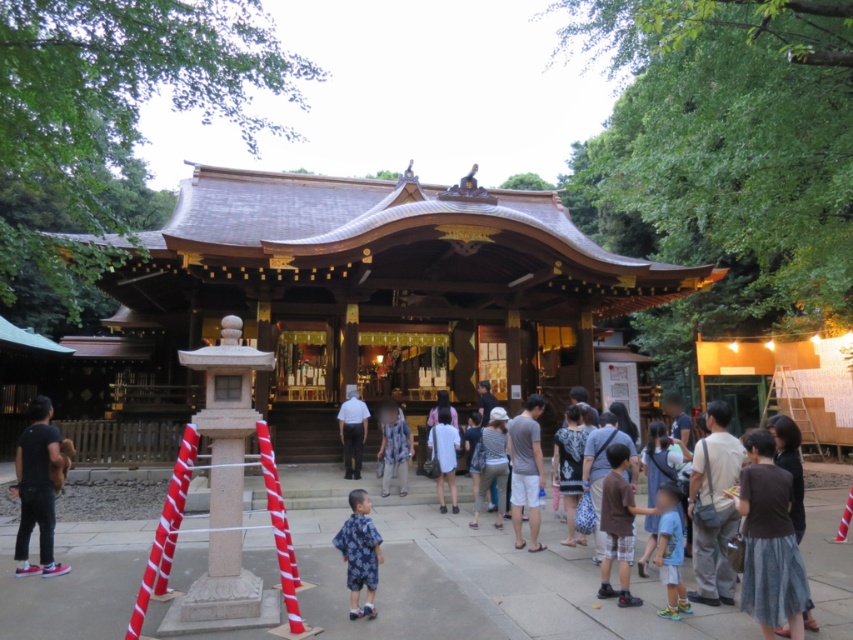
Question: Where is dark gray fabric pants at lower left located in relation to white cotton shirt at center in the image?

Choices:
 (A) right
 (B) left

Answer: (B)

Question: Which point is closer to the camera taking this photo?

Choices:
 (A) (352, 401)
 (B) (361, 500)
 (C) (18, 492)

Answer: (B)

Question: Is dark gray fabric pants at lower left above white cotton shirt at center?

Choices:
 (A) no
 (B) yes

Answer: (B)

Question: Does blue printed shirt at lower center lie behind blue plaid shirt at center?

Choices:
 (A) yes
 (B) no

Answer: (B)

Question: Estimate the real-world distances between objects in this image. Which object is farther from the blue plaid shirt at center?

Choices:
 (A) blue printed shirt at lower center
 (B) white cotton shirt at center
 (C) dark gray fabric pants at lower left

Answer: (A)

Question: Which object appears farthest from the camera in this image?

Choices:
 (A) blue printed shirt at lower center
 (B) blue plaid shirt at center
 (C) dark gray fabric pants at lower left
 (D) white cotton shirt at center

Answer: (D)